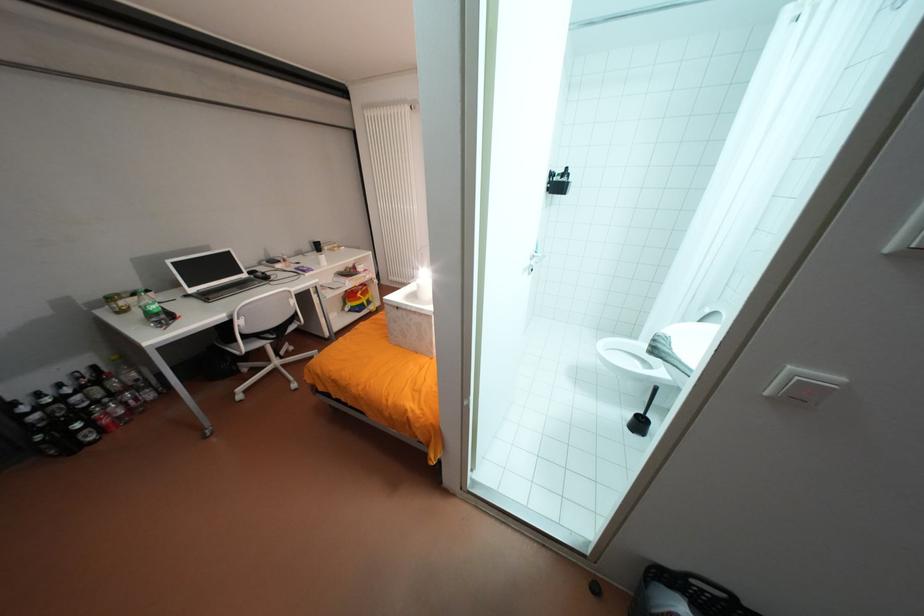
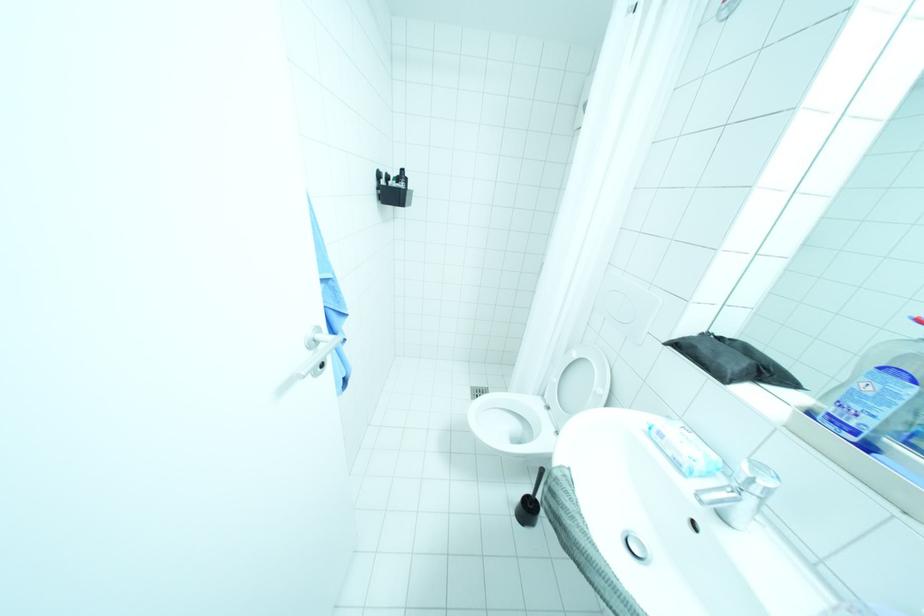
The images are taken continuously from a first-person perspective. In which direction are you moving?

The movement direction of the cameraman is right, forward.